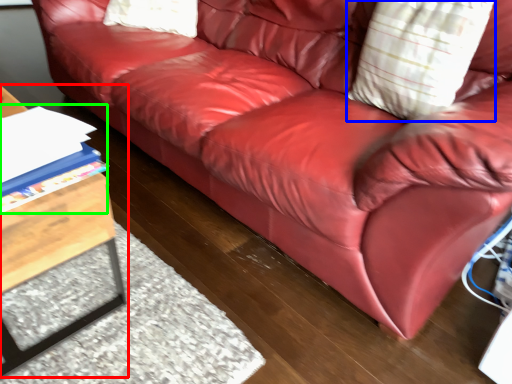
Question: Estimate the real-world distances between objects in this image. Which object is farther from table (highlighted by a red box), throw pillow (highlighted by a blue box) or book (highlighted by a green box)?

Choices:
 (A) throw pillow
 (B) book

Answer: (A)